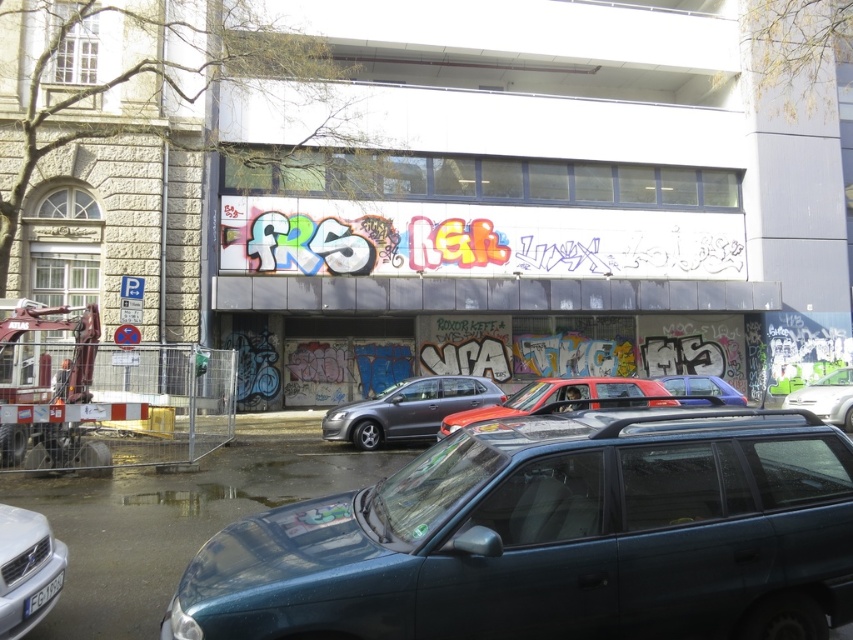
Question: Is metallic blue minivan at lower center smaller than metallic red car at center?

Choices:
 (A) yes
 (B) no

Answer: (A)

Question: Among these points, which one is nearest to the camera?

Choices:
 (A) (408, 396)
 (B) (795, 456)
 (C) (595, 404)
 (D) (822, 396)

Answer: (B)

Question: Which of the following is the closest to the observer?

Choices:
 (A) white plastic license plate at lower left
 (B) metallic blue sedan at center
 (C) metallic blue minivan at lower center

Answer: (C)

Question: Considering the relative positions of metallic blue minivan at lower center and silver metallic car at lower left in the image provided, where is metallic blue minivan at lower center located with respect to silver metallic car at lower left?

Choices:
 (A) above
 (B) below

Answer: (A)

Question: Can you confirm if metallic red car at center is wider than metallic blue sedan at center?

Choices:
 (A) yes
 (B) no

Answer: (B)

Question: Which of these objects is positioned farthest from the metallic red car at center?

Choices:
 (A) silver metallic car at lower left
 (B) metallic blue minivan at lower center
 (C) white plastic license plate at lower left
 (D) metallic blue sedan at center

Answer: (C)